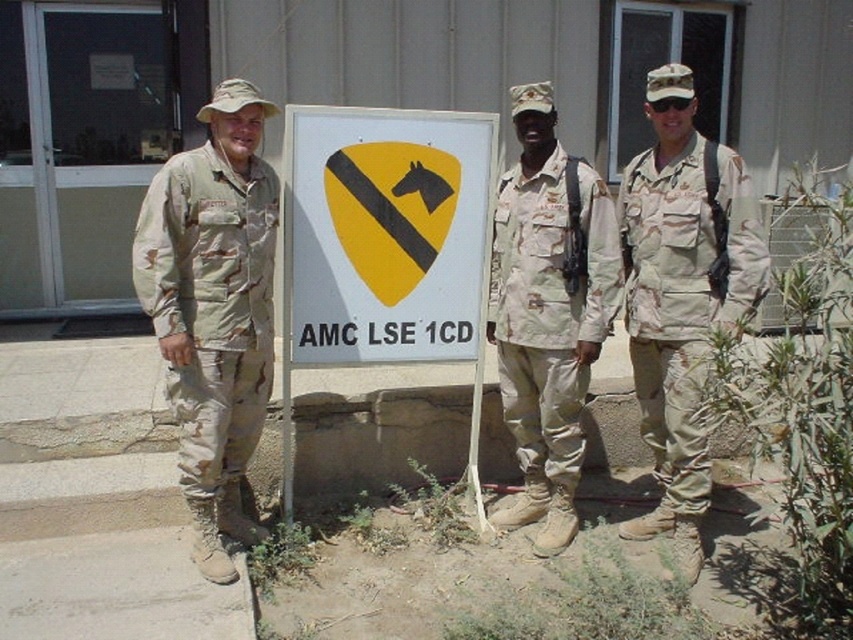
Which is more to the left, yellowmattesign at center or camouflage uniform at center?

From the viewer's perspective, yellowmattesign at center appears more on the left side.

Who is shorter, yellowmattesign at center or camouflage uniform at center?

yellowmattesign at center is shorter.

Describe the element at coordinates (386, 234) in the screenshot. I see `yellowmattesign at center` at that location.

Locate an element on the screen. The width and height of the screenshot is (853, 640). yellowmattesign at center is located at coordinates (386, 234).

Between camouflage uniform at center and camouflage fabric uniform at right, which one is positioned lower?

camouflage fabric uniform at right is below.

Is camouflage uniform at center bigger than camouflage fabric uniform at right?

Yes.

Find the location of `camouflage uniform at center`. camouflage uniform at center is located at coordinates (682, 296).

Between yellowmattesign at center and camouflage fabric uniform at left, which one appears on the left side from the viewer's perspective?

camouflage fabric uniform at left

Measure the distance between yellowmattesign at center and camera.

yellowmattesign at center is 3.61 meters from camera.

Between point (346, 323) and point (187, 387), which one is positioned in front?

Point (187, 387)

You are a GUI agent. You are given a task and a screenshot of the screen. Output one action in this format:
    pyautogui.click(x=<x>, y=<y>)
    Task: Click on the yellowmattesign at center
    Image resolution: width=853 pixels, height=640 pixels.
    Given the screenshot: What is the action you would take?
    pyautogui.click(x=386, y=234)